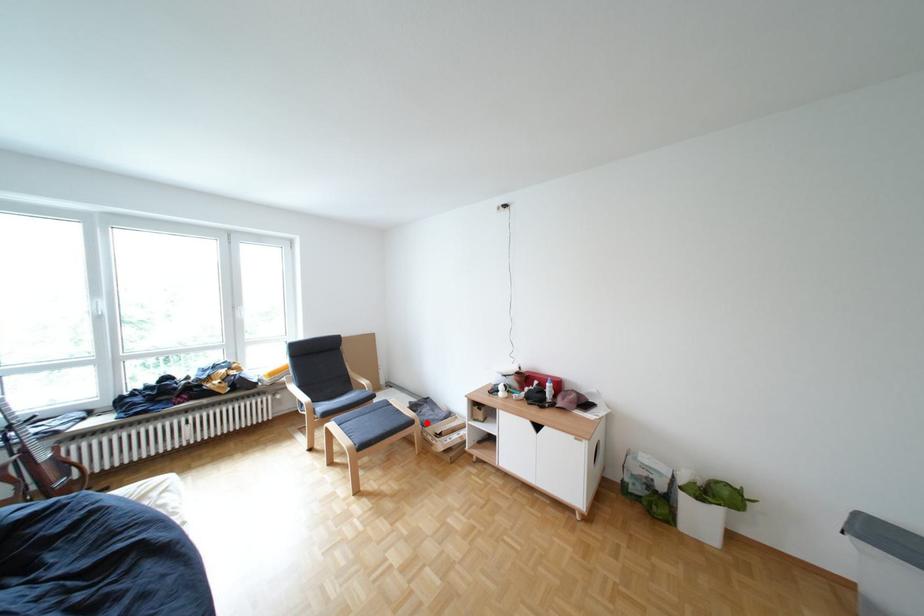
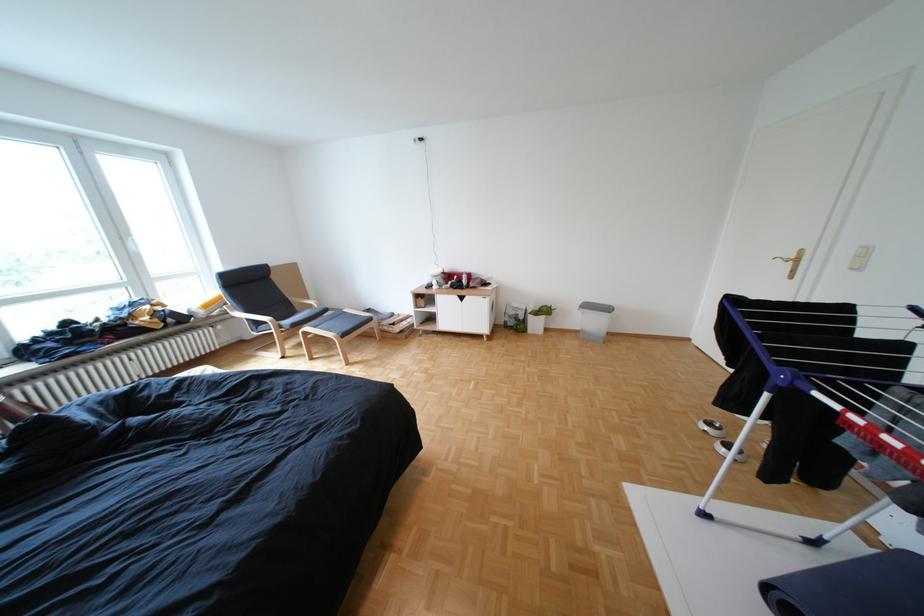
Where in the second image is the point corresponding to the highlighted location from the first image?

(386, 320)